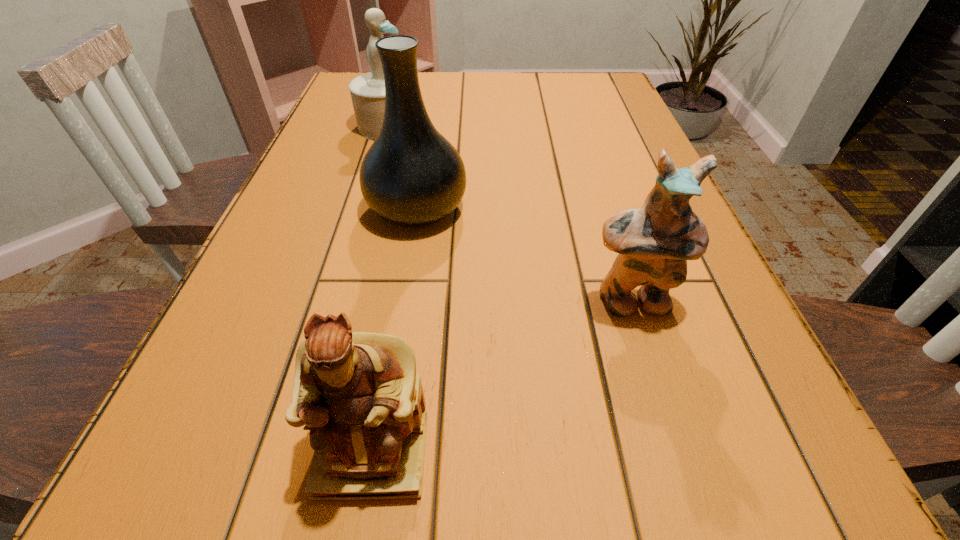
The width and height of the screenshot is (960, 540). Identify the location of empty space that is in between the second nearest figurine and the farthest object. (510, 214).

Where is `vacant area between the rightmost object and the nearest figurine`? This screenshot has width=960, height=540. vacant area between the rightmost object and the nearest figurine is located at coordinates (502, 377).

I want to click on free space between the farthest object and the nearest object, so click(380, 290).

Locate an element on the screen. This screenshot has width=960, height=540. unoccupied position between the third farthest object and the third nearest object is located at coordinates (524, 255).

This screenshot has width=960, height=540. In order to click on object that is the third closest to the nearest figurine in this screenshot , I will do `click(367, 91)`.

Select which object appears as the second closest to the nearest figurine. Please provide its 2D coordinates. Your answer should be formatted as a tuple, i.e. [(x, y)], where the tuple contains the x and y coordinates of a point satisfying the conditions above.

[(412, 176)]

Identify which figurine is located as the second nearest to the farthest object. Please provide its 2D coordinates. Your answer should be formatted as a tuple, i.e. [(x, y)], where the tuple contains the x and y coordinates of a point satisfying the conditions above.

[(359, 394)]

Locate which figurine ranks in proximity to the nearest object. Please provide its 2D coordinates. Your answer should be formatted as a tuple, i.e. [(x, y)], where the tuple contains the x and y coordinates of a point satisfying the conditions above.

[(654, 242)]

I want to click on vacant space that satisfies the following two spatial constraints: 1. at the beak of the farthest object; 2. on the back side of the second farthest object, so click(x=363, y=208).

You are a GUI agent. You are given a task and a screenshot of the screen. Output one action in this format:
    pyautogui.click(x=<x>, y=<y>)
    Task: Click on the vacant space that satisfies the following two spatial constraints: 1. at the beak of the farthest object; 2. on the left side of the second farthest object
    
    Given the screenshot: What is the action you would take?
    pyautogui.click(x=363, y=208)